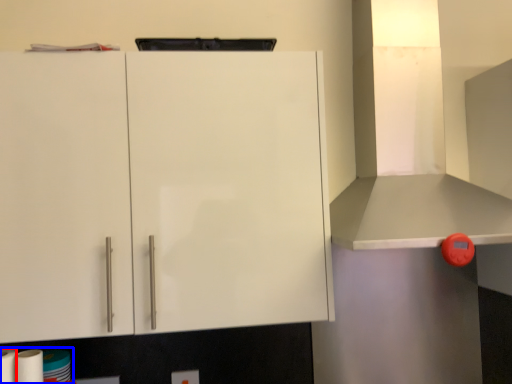
Question: Which of the following is the closest to the observer, paper towel (highlighted by a red box) or toilet paper (highlighted by a blue box)?

Choices:
 (A) paper towel
 (B) toilet paper

Answer: (A)